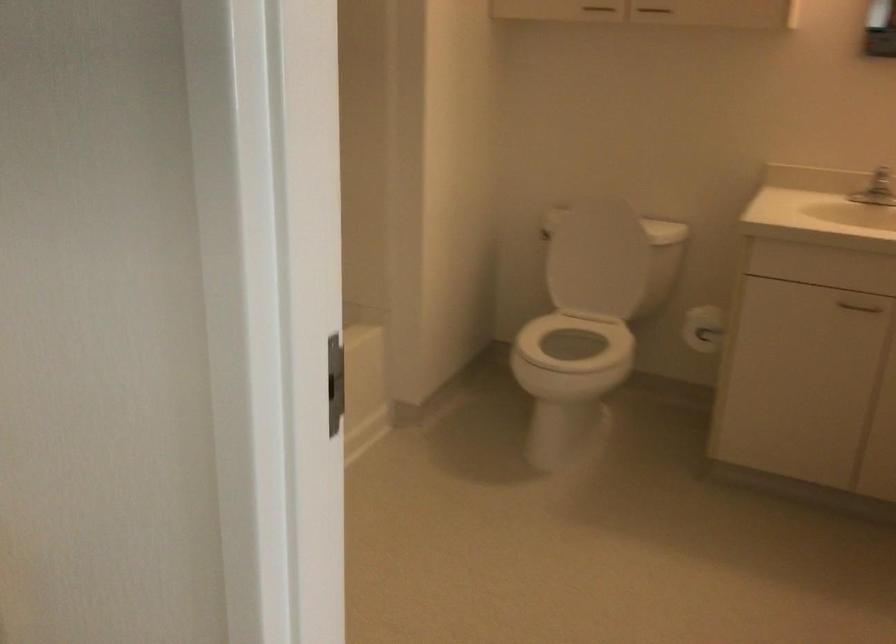
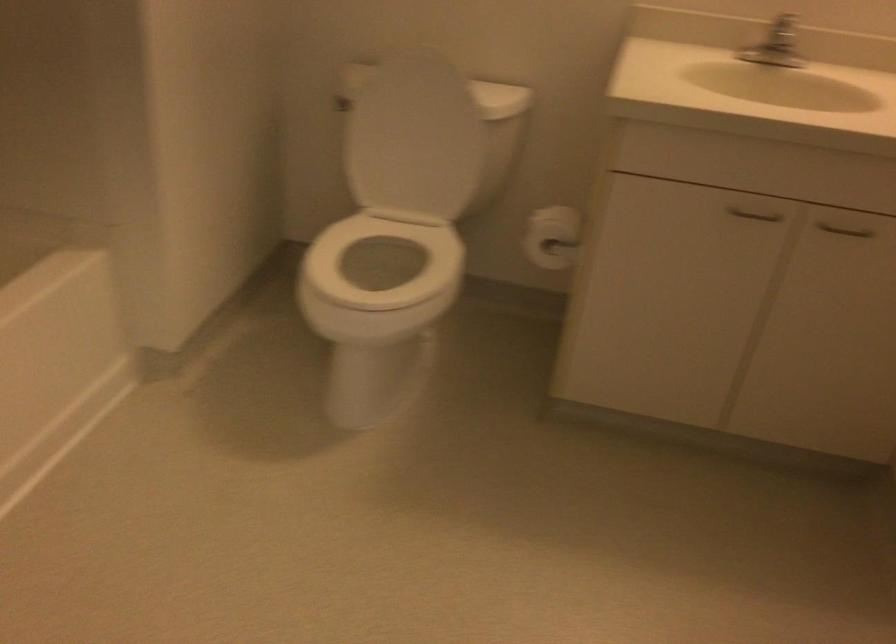
Question: How did the camera likely rotate?

Choices:
 (A) Left
 (B) Right
 (C) Up
 (D) Down

Answer: (B)